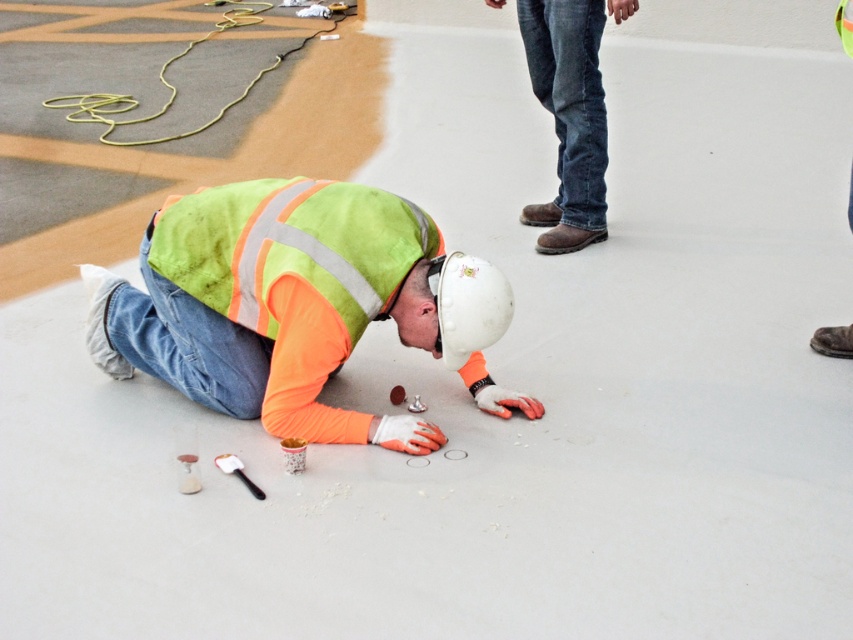
You are a safety inspector examining the construction site. You notice the high visibility fabric vest at center and the jeans at upper right. Which item is positioned to the left of the other?

The high visibility fabric vest at center is to the left of jeans at upper right.

You are a safety inspector standing at the entrance of the construction site. You need to check if the worker wearing the high visibility fabric vest at center is within the safe inspection range of 3 meters. Is the worker within the safe distance?

The high visibility fabric vest at center is 3.01 meters away from the viewer, which is just beyond the 3 meter safe inspection range. The worker is slightly out of the safe distance.